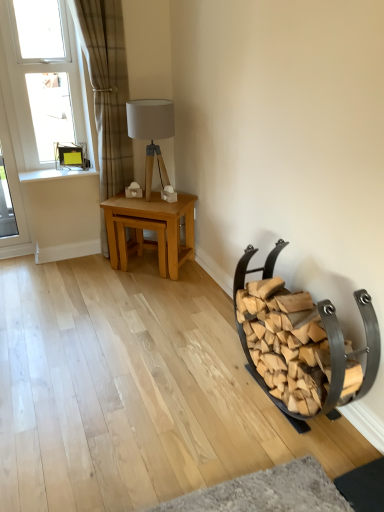
I want to click on vacant space in front of wooden firewood rack at lower right, so click(271, 466).